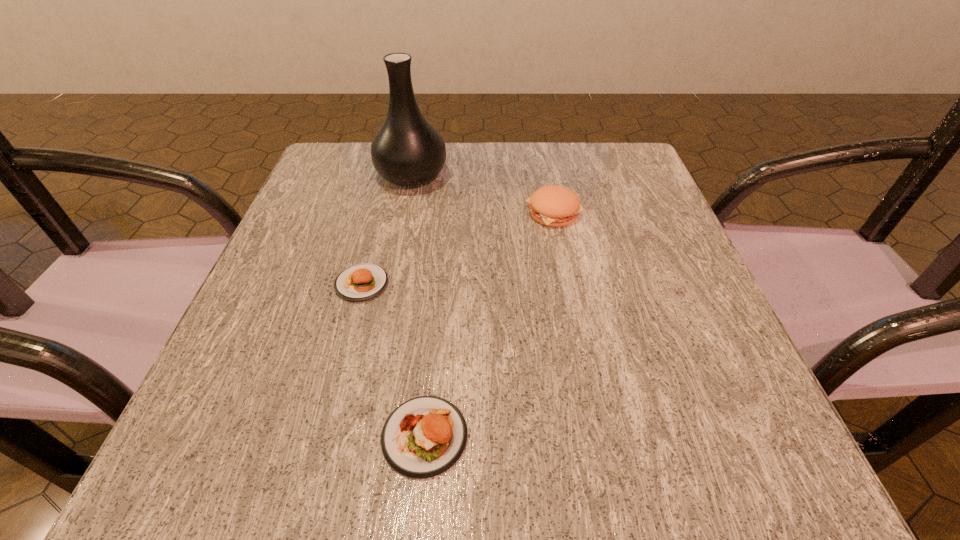
At what (x,y) coordinates should I click in order to perform the action: click on vacant area that lies between the second farthest food and the nearest food. Please return your answer as a coordinate pair (x, y). Looking at the image, I should click on (394, 360).

Locate an element on the screen. vacant point located between the second nearest object and the nearest food is located at coordinates (394, 360).

Where is `unoccupied position between the second nearest food and the rightmost object`? The image size is (960, 540). unoccupied position between the second nearest food and the rightmost object is located at coordinates (458, 248).

Image resolution: width=960 pixels, height=540 pixels. I want to click on vacant area that lies between the vase and the leftmost food, so click(x=387, y=230).

Locate an element on the screen. The width and height of the screenshot is (960, 540). vacant point located between the farthest food and the leftmost food is located at coordinates (458, 248).

Locate an element on the screen. The image size is (960, 540). free space between the rightmost object and the vase is located at coordinates (482, 193).

This screenshot has height=540, width=960. Identify the location of object that stands as the third closest to the shortest food. (555, 206).

Find the location of a particular element. The height and width of the screenshot is (540, 960). the third closest object to the nearest object is located at coordinates (x=407, y=150).

Select which food appears as the closest to the shortest object. Please provide its 2D coordinates. Your answer should be formatted as a tuple, i.e. [(x, y)], where the tuple contains the x and y coordinates of a point satisfying the conditions above.

[(425, 436)]

Find the location of a particular element. The image size is (960, 540). food that is the second nearest to the nearest object is located at coordinates (555, 206).